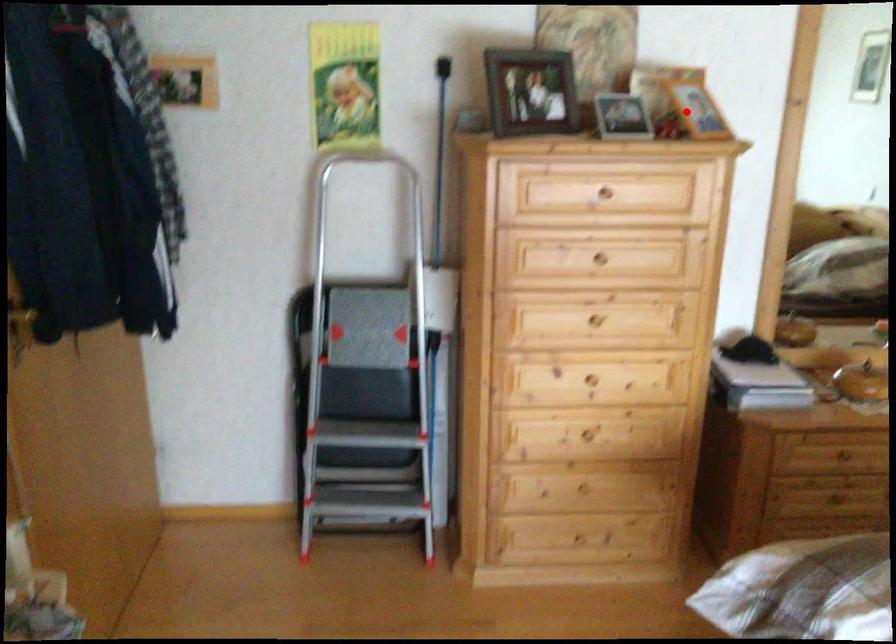
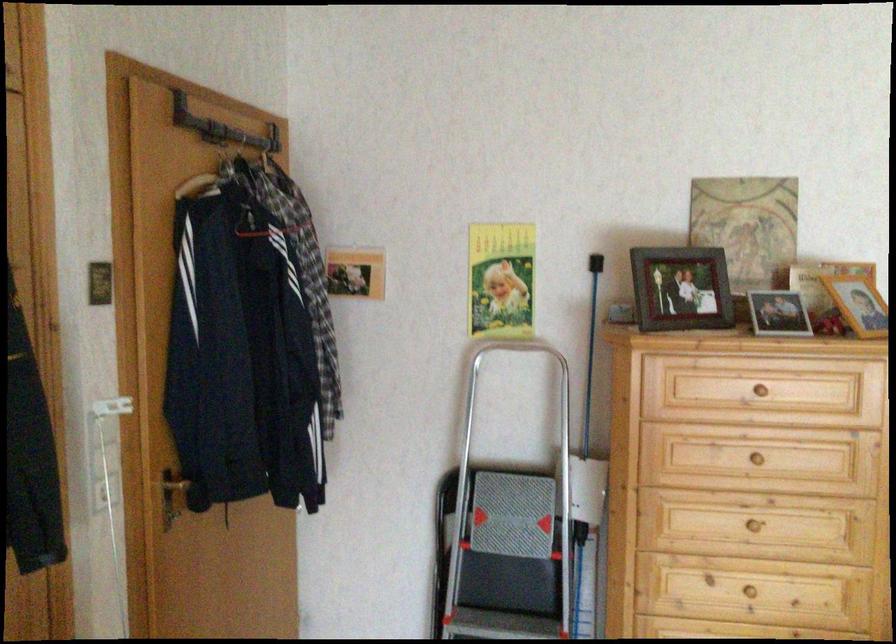
Locate, in the second image, the point that corresponds to the highlighted location in the first image.

(857, 304)